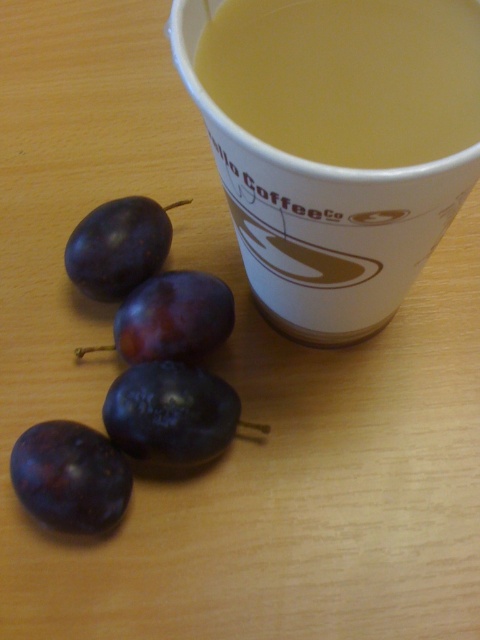
Question: Which point appears closest to the camera in this image?

Choices:
 (A) (219, 307)
 (B) (282, 56)
 (C) (97, 232)
 (D) (256, 220)

Answer: (B)

Question: Considering the relative positions of yellow liquid at upper center and dark purple plum at lower left in the image provided, where is yellow liquid at upper center located with respect to dark purple plum at lower left?

Choices:
 (A) right
 (B) left

Answer: (A)

Question: Can you confirm if dark purple plum at lower left is wider than shiny dark purple plum at upper left?

Choices:
 (A) yes
 (B) no

Answer: (B)

Question: Is shiny purple plum at center above shiny dark purple plum at upper left?

Choices:
 (A) no
 (B) yes

Answer: (A)

Question: Which object is farther from the camera taking this photo?

Choices:
 (A) shiny purple plum at center
 (B) yellow paper cup at upper center
 (C) dark purple plum at lower left

Answer: (A)

Question: Which is nearer to the yellow paper cup at upper center?

Choices:
 (A) dark purple plum at lower left
 (B) yellow liquid at upper center
 (C) shiny purple plum at center
 (D) shiny dark purple plum at upper left

Answer: (B)